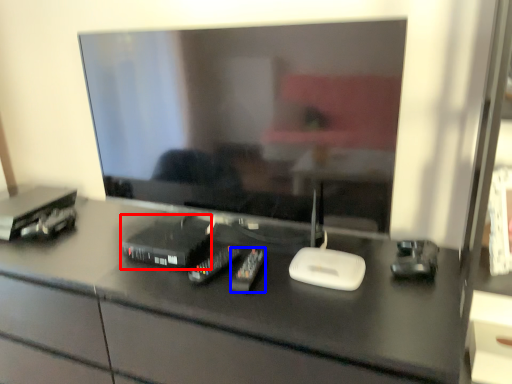
Question: Which of the following is the closest to the observer, equipment (highlighted by a red box) or equipment (highlighted by a blue box)?

Choices:
 (A) equipment
 (B) equipment

Answer: (B)